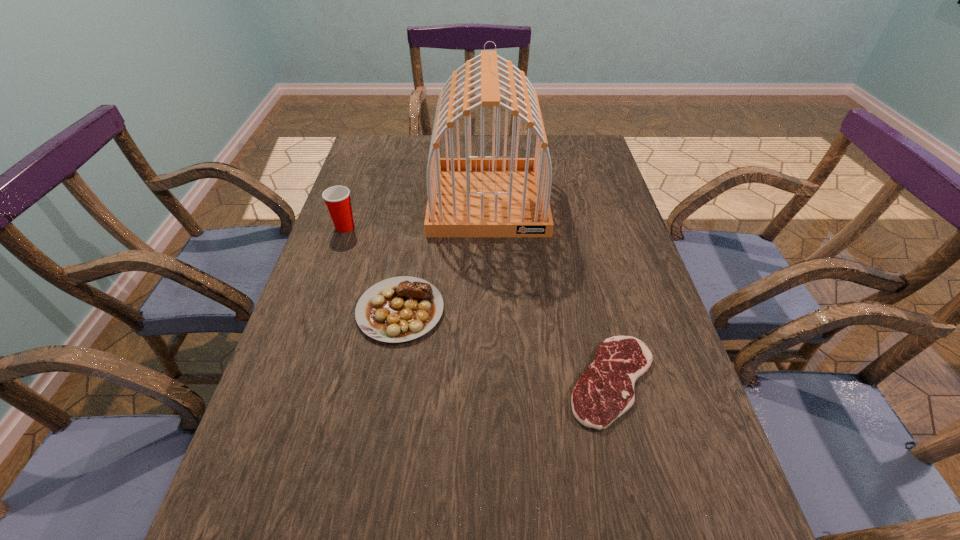
This screenshot has width=960, height=540. I want to click on free space located on the left of the shortest object, so click(460, 381).

This screenshot has width=960, height=540. What are the coordinates of `object present at the far edge` in the screenshot? It's located at (478, 196).

Where is `Dixie cup located at the left edge`? The image size is (960, 540). Dixie cup located at the left edge is located at coordinates (337, 198).

At what (x,y) coordinates should I click in order to perform the action: click on steak present at the left edge. Please return your answer as a coordinate pair (x, y). This screenshot has height=540, width=960. Looking at the image, I should click on (399, 309).

Where is `object that is at the right edge`? The image size is (960, 540). object that is at the right edge is located at coordinates (605, 391).

Locate an element on the screen. vacant region at the far edge is located at coordinates (474, 148).

Image resolution: width=960 pixels, height=540 pixels. In the image, there is a desktop. Identify the location of free space at the left edge. click(309, 525).

At what (x,y) coordinates should I click in order to perform the action: click on vacant space at the right edge of the desktop. Please return your answer as a coordinate pair (x, y). This screenshot has width=960, height=540. Looking at the image, I should click on (615, 211).

The width and height of the screenshot is (960, 540). In the image, there is a desktop. In order to click on vacant area at the far left corner in this screenshot , I will do `click(406, 157)`.

You are a GUI agent. You are given a task and a screenshot of the screen. Output one action in this format:
    pyautogui.click(x=<x>, y=<y>)
    Task: Click on the free space at the far right corner of the desktop
    The width and height of the screenshot is (960, 540).
    Given the screenshot: What is the action you would take?
    pyautogui.click(x=578, y=147)